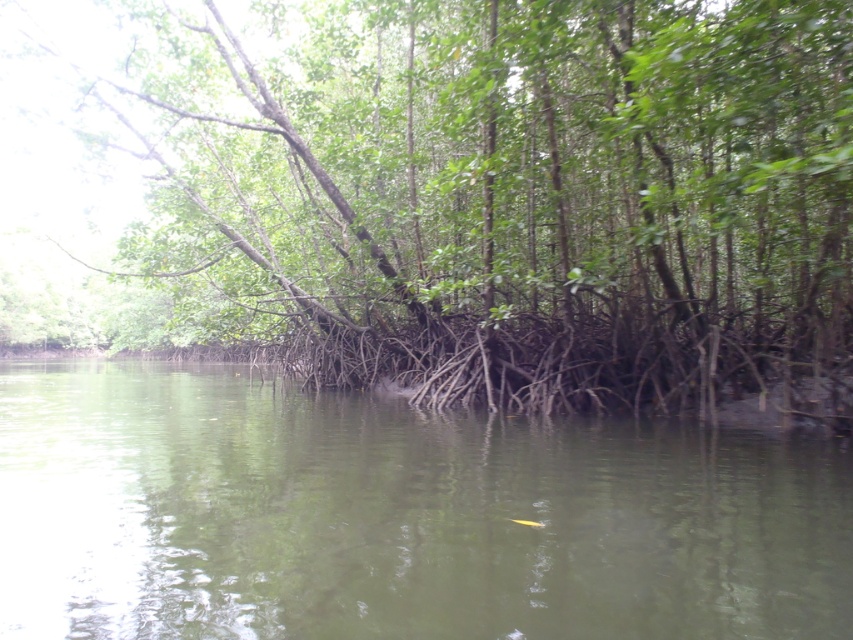
Can you confirm if green leafy tree at center is taller than green murky water at center?

Yes, green leafy tree at center is taller than green murky water at center.

Is green leafy tree at center to the right of green murky water at center from the viewer's perspective?

No, green leafy tree at center is not to the right of green murky water at center.

This screenshot has height=640, width=853. I want to click on green leafy tree at center, so click(505, 196).